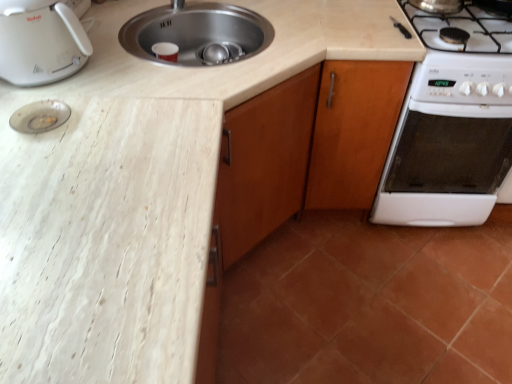
Identify the location of spots to the right of transparent glass plate at upper left. (111, 118).